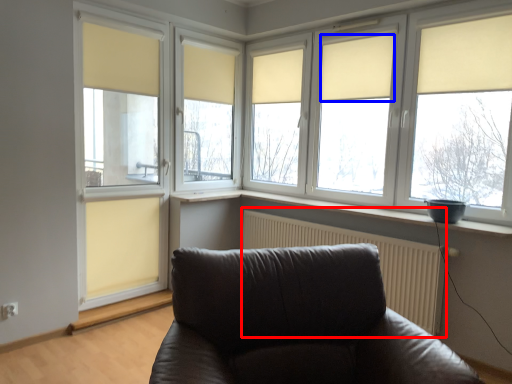
Question: Which of the following is the closest to the observer, radiator (highlighted by a red box) or curtain (highlighted by a blue box)?

Choices:
 (A) radiator
 (B) curtain

Answer: (A)